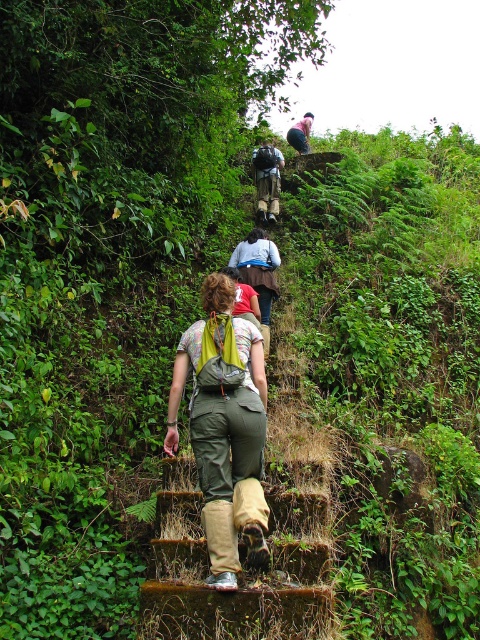
You are a hiker standing at the base of the brown wood stairs at center. You want to reach the top of the stairs which is 5 meters away. Can you make it in one continuous climb without stopping?

The brown wood stairs at center is 4.53 meters from viewer, so yes, you can climb the brown wood stairs at center in one continuous climb since the distance is slightly less than 5 meters.

You are one of the hikers wearing the matte khaki pants at center. You want to step onto the brown wood stairs at center. Can you reach them from your current position?

The brown wood stairs at center is in front of matte khaki pants at center, so yes, you can step onto the brown wood stairs at center from your current position since they are directly ahead of you.